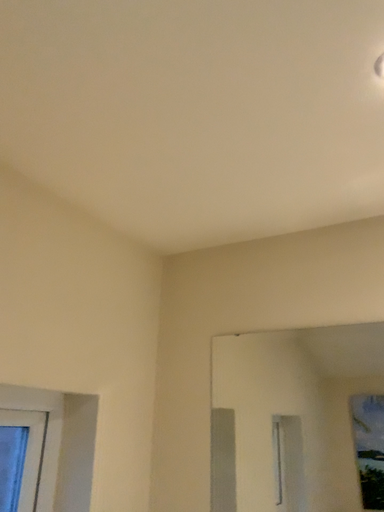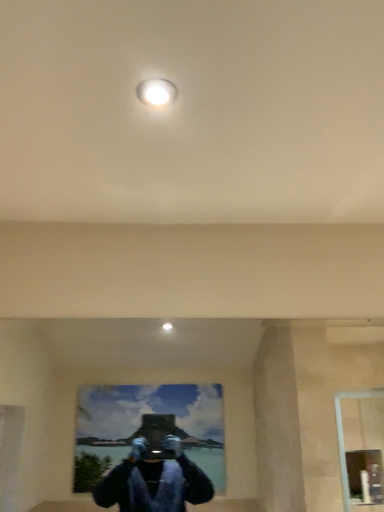
Question: How did the camera likely rotate when shooting the video?

Choices:
 (A) rotated left
 (B) rotated right

Answer: (B)